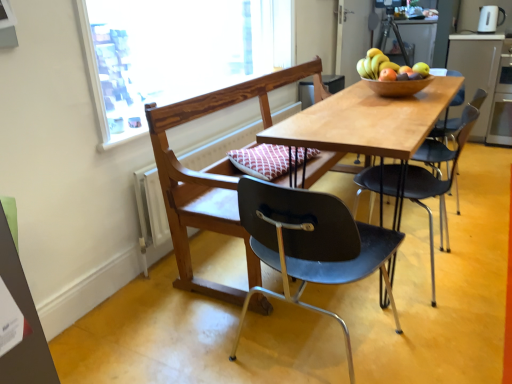
You are a GUI agent. You are given a task and a screenshot of the screen. Output one action in this format:
    pyautogui.click(x=<x>, y=<y>)
    Task: Click on the vacant space in front of smooth yellow pear at upper right, arranged as the 1th fruit when viewed from the right
    Image resolution: width=512 pixels, height=384 pixels.
    Given the screenshot: What is the action you would take?
    pyautogui.click(x=432, y=87)